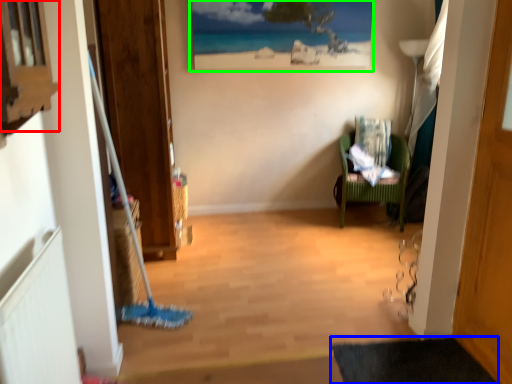
Question: Estimate the real-world distances between objects in this image. Which object is farther from window (highlighted by a red box), bath mat (highlighted by a blue box) or picture frame (highlighted by a green box)?

Choices:
 (A) bath mat
 (B) picture frame

Answer: (B)